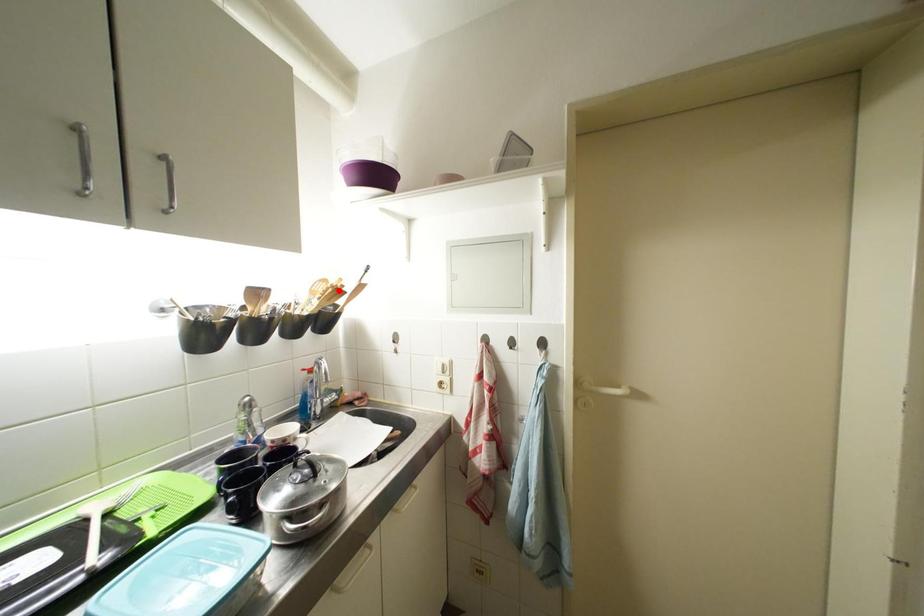
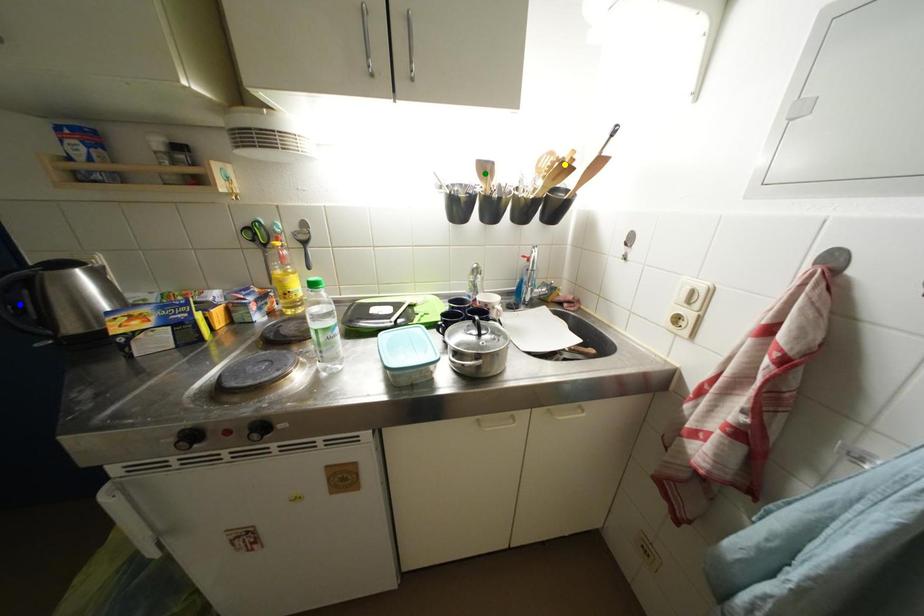
Question: I am providing you with two images of the same scene from different viewpoints. A red point is marked on the first image. You are given multiple points on the second image. Which point in image 2 is actually the same real-world point as the red point in image 1?

Choices:
 (A) yellow point
 (B) blue point
 (C) green point

Answer: (A)